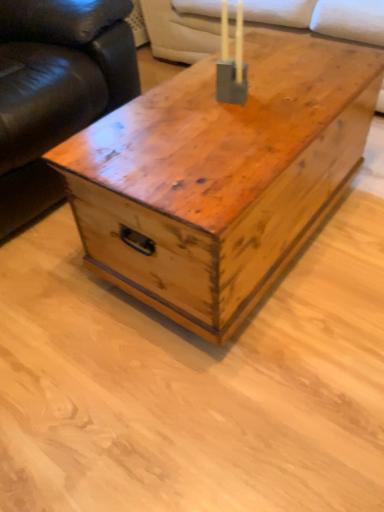
Question: Is leather couch at left shorter than matte gray concrete candle holder at center?

Choices:
 (A) no
 (B) yes

Answer: (A)

Question: Considering the relative sizes of leather couch at left and matte gray concrete candle holder at center in the image provided, is leather couch at left bigger than matte gray concrete candle holder at center?

Choices:
 (A) yes
 (B) no

Answer: (A)

Question: Is leather couch at left to the right of matte gray concrete candle holder at center from the viewer's perspective?

Choices:
 (A) no
 (B) yes

Answer: (A)

Question: Is leather couch at left oriented away from matte gray concrete candle holder at center?

Choices:
 (A) no
 (B) yes

Answer: (A)

Question: Would you say leather couch at left contains matte gray concrete candle holder at center?

Choices:
 (A) no
 (B) yes

Answer: (A)

Question: From a real-world perspective, does leather couch at left sit lower than matte gray concrete candle holder at center?

Choices:
 (A) no
 (B) yes

Answer: (B)

Question: Is matte gray concrete candle holder at center not inside suede-like beige couch at upper center?

Choices:
 (A) yes
 (B) no

Answer: (A)

Question: Is matte gray concrete candle holder at center surrounding suede-like beige couch at upper center?

Choices:
 (A) no
 (B) yes

Answer: (A)

Question: Is matte gray concrete candle holder at center facing away from suede-like beige couch at upper center?

Choices:
 (A) no
 (B) yes

Answer: (A)

Question: Considering the relative positions of matte gray concrete candle holder at center and suede-like beige couch at upper center in the image provided, is matte gray concrete candle holder at center to the right of suede-like beige couch at upper center from the viewer's perspective?

Choices:
 (A) no
 (B) yes

Answer: (A)

Question: Can you confirm if matte gray concrete candle holder at center is wider than suede-like beige couch at upper center?

Choices:
 (A) yes
 (B) no

Answer: (B)

Question: Is matte gray concrete candle holder at center taller than suede-like beige couch at upper center?

Choices:
 (A) yes
 (B) no

Answer: (B)

Question: Considering the relative sizes of matte gray concrete candle holder at center and wooden trunk at center in the image provided, is matte gray concrete candle holder at center taller than wooden trunk at center?

Choices:
 (A) yes
 (B) no

Answer: (B)